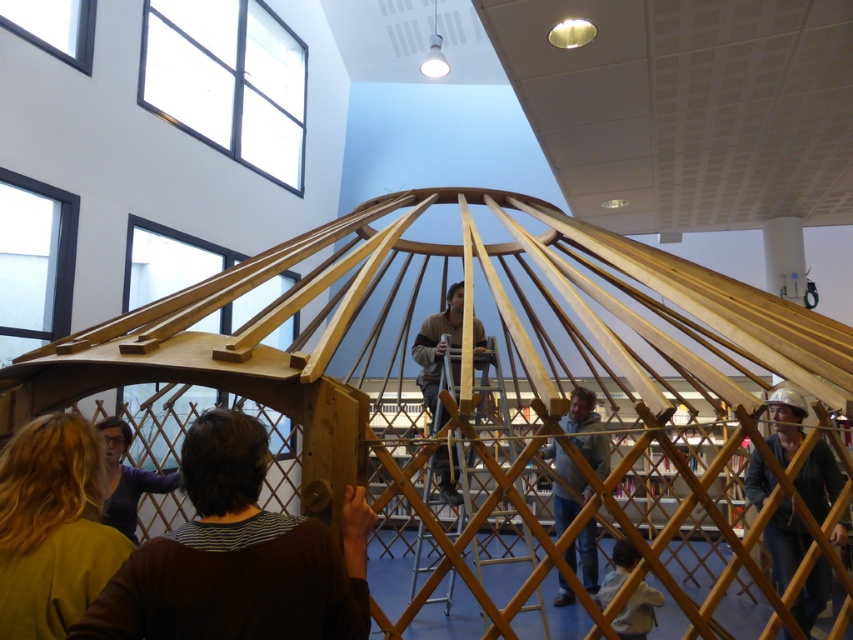
From the picture: You are a photographer standing at the center of the room. You want to capture a closeup of the blonde hair at lower left. Which direction should you move to get closer to it?

You should move to the lower left direction to get closer to the blonde hair at lower left.

You are a photographer trying to capture a clear shot of the blonde hair at lower left and the light brown wooden frame at lower center. Based on their heights, which one would require you to adjust your camera angle upwards to include both in the frame?

The blonde hair at lower left is taller than the light brown wooden frame at lower center, so you would need to adjust your camera angle upwards to include both in the frame.